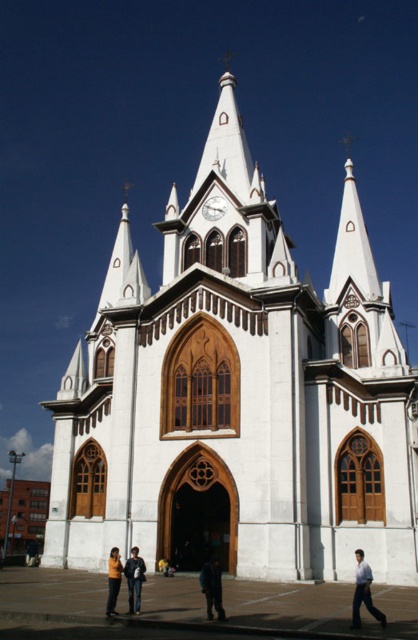
Question: Can you confirm if yellow leather jacket at center is wider than orange fabric jacket at lower center?

Choices:
 (A) no
 (B) yes

Answer: (A)

Question: Which point is farther from the camera taking this photo?

Choices:
 (A) (357, 593)
 (B) (218, 598)
 (C) (140, 605)

Answer: (C)

Question: In this image, where is light blue shirt at lower right located relative to dark blue fabric jacket at center?

Choices:
 (A) above
 (B) below

Answer: (A)

Question: Which object is positioned closest to the orange fabric jacket at lower center?

Choices:
 (A) light blue shirt at lower right
 (B) dark blue fabric jacket at center
 (C) yellow leather jacket at center

Answer: (C)

Question: Which point is closer to the camera?

Choices:
 (A) (214, 556)
 (B) (361, 580)
 (C) (139, 577)

Answer: (B)

Question: Can you confirm if yellow leather jacket at center is positioned above orange fabric jacket at lower center?

Choices:
 (A) no
 (B) yes

Answer: (B)